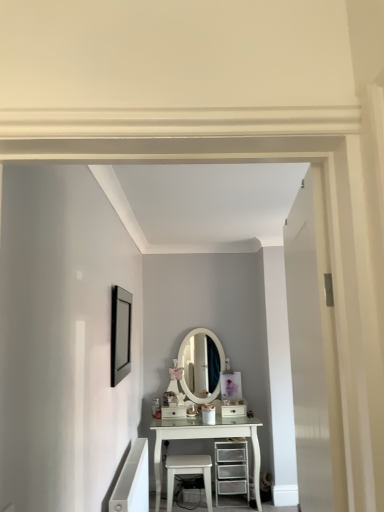
Question: Can you confirm if white glossy stool at lower center is thinner than matte black picture frame at upper left?

Choices:
 (A) no
 (B) yes

Answer: (A)

Question: From the image's perspective, is white glossy stool at lower center on matte black picture frame at upper left?

Choices:
 (A) no
 (B) yes

Answer: (A)

Question: Is white glossy stool at lower center shorter than matte black picture frame at upper left?

Choices:
 (A) no
 (B) yes

Answer: (B)

Question: Considering the relative positions of white glossy stool at lower center and matte black picture frame at upper left in the image provided, is white glossy stool at lower center to the left of matte black picture frame at upper left from the viewer's perspective?

Choices:
 (A) no
 (B) yes

Answer: (A)

Question: Is white glossy stool at lower center positioned behind matte black picture frame at upper left?

Choices:
 (A) yes
 (B) no

Answer: (A)

Question: Considering the positions of white glossy drawer at center, marked as the first drawer in a left-to-right arrangement, and white matte door at right in the image, is white glossy drawer at center, marked as the first drawer in a left-to-right arrangement, wider or thinner than white matte door at right?

Choices:
 (A) thin
 (B) wide

Answer: (B)

Question: Is white glossy drawer at center, marked as the 2th drawer in a right-to-left arrangement, bigger or smaller than white matte door at right?

Choices:
 (A) small
 (B) big

Answer: (A)

Question: From the image's perspective, is white glossy drawer at center, marked as the first drawer in a left-to-right arrangement, positioned above or below white matte door at right?

Choices:
 (A) below
 (B) above

Answer: (A)

Question: In the image, is white glossy drawer at center, marked as the first drawer in a left-to-right arrangement, on the left side or the right side of white matte door at right?

Choices:
 (A) left
 (B) right

Answer: (A)

Question: In terms of width, does white matte door at right look wider or thinner when compared to white glossy stool at lower center?

Choices:
 (A) thin
 (B) wide

Answer: (A)

Question: From the image's perspective, is white matte door at right positioned above or below white glossy stool at lower center?

Choices:
 (A) above
 (B) below

Answer: (A)

Question: Looking at the image, does white matte door at right seem bigger or smaller compared to white glossy stool at lower center?

Choices:
 (A) big
 (B) small

Answer: (A)

Question: Considering the positions of point (301, 470) and point (167, 505), is point (301, 470) closer or farther from the camera than point (167, 505)?

Choices:
 (A) closer
 (B) farther

Answer: (A)

Question: Does point [x=183, y=415] appear closer or farther from the camera than point [x=236, y=414]?

Choices:
 (A) closer
 (B) farther

Answer: (A)

Question: From the image's perspective, is white glossy drawer at center, marked as the first drawer in a left-to-right arrangement, located above or below white glossy drawer at center, positioned as the 2th drawer in left-to-right order?

Choices:
 (A) below
 (B) above

Answer: (A)